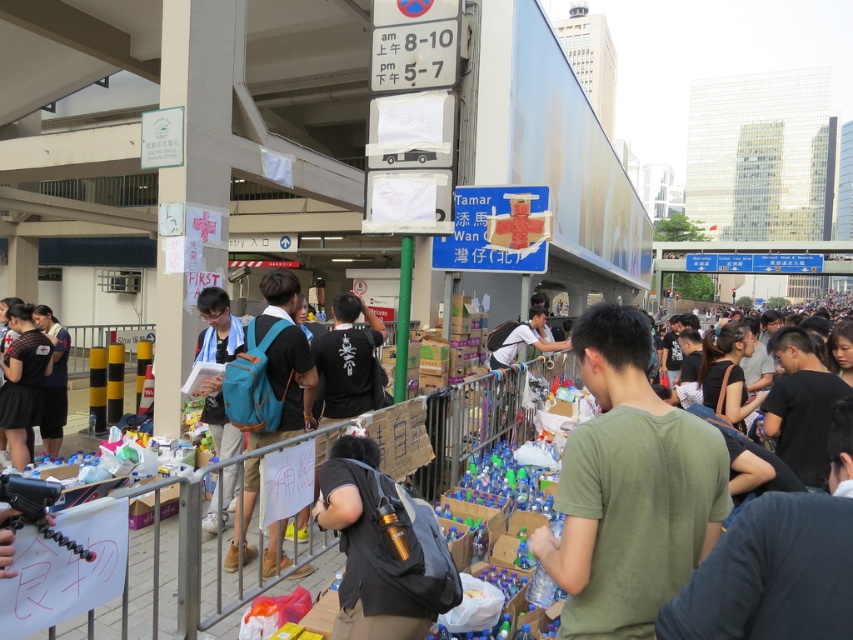
Looking at this image, you are part of a relief team distributing supplies and need to quickly identify the teal fabric backpack at center and the light blue backpack at center. From the perspective of someone facing the backpacks, which backpack is positioned to the left?

The teal fabric backpack at center is positioned to the left of the light blue backpack at center.

You are organizing a relief operation and need to distribute supplies. You have a teal fabric backpack at center and a light blue backpack at center. Which backpack can carry more items?

The teal fabric backpack at center has a larger size compared to the light blue backpack at center, so it can carry more items.